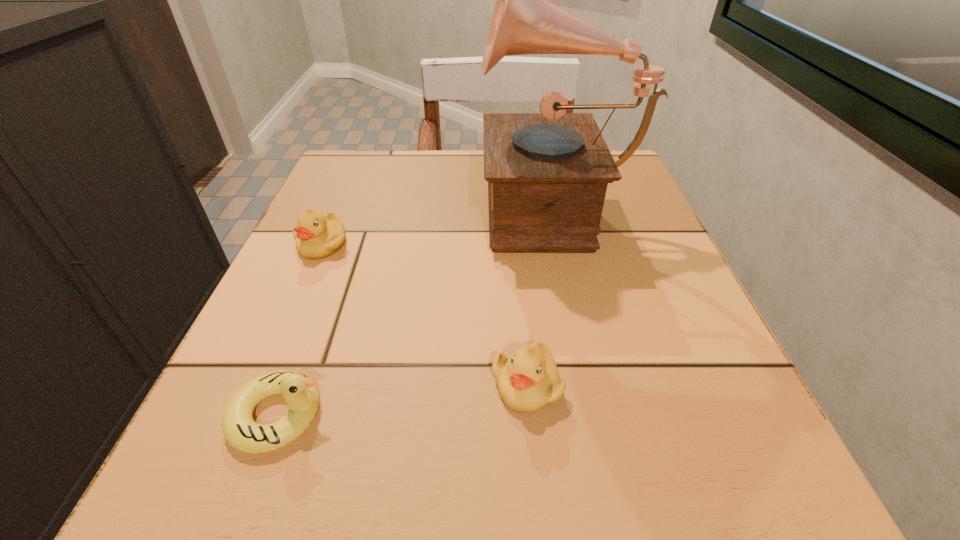
Where is `vacant region that satisfies the following two spatial constraints: 1. on the horn of the tallest object; 2. on the front-facing side of the rightmost duckling`? vacant region that satisfies the following two spatial constraints: 1. on the horn of the tallest object; 2. on the front-facing side of the rightmost duckling is located at coordinates (593, 384).

You are a GUI agent. You are given a task and a screenshot of the screen. Output one action in this format:
    pyautogui.click(x=<x>, y=<y>)
    Task: Click on the blank area in the image that satisfies the following two spatial constraints: 1. on the horn of the tallest object; 2. on the front-facing side of the farthest duckling
    The height and width of the screenshot is (540, 960).
    Given the screenshot: What is the action you would take?
    pyautogui.click(x=562, y=244)

Find the location of a particular element. The height and width of the screenshot is (540, 960). free location that satisfies the following two spatial constraints: 1. on the horn of the record player; 2. on the front-facing side of the rightmost duckling is located at coordinates (593, 384).

The height and width of the screenshot is (540, 960). Identify the location of vacant area in the image that satisfies the following two spatial constraints: 1. on the horn of the record player; 2. on the front-facing side of the farthest duckling. (562, 244).

At what (x,y) coordinates should I click in order to perform the action: click on vacant space that satisfies the following two spatial constraints: 1. on the horn of the tallest object; 2. on the front-facing side of the farthest duckling. Please return your answer as a coordinate pair (x, y). The height and width of the screenshot is (540, 960). Looking at the image, I should click on (562, 244).